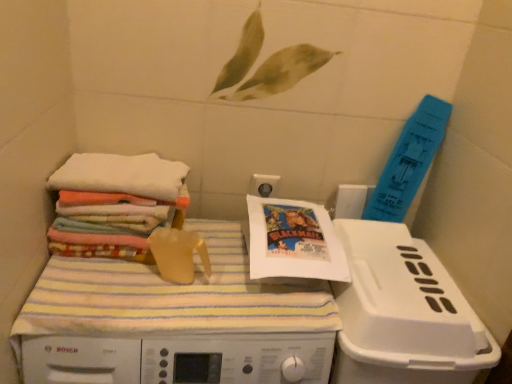
Locate an element on the screen. Image resolution: width=512 pixels, height=384 pixels. vacant region to the left of white paper comic book at center is located at coordinates (224, 246).